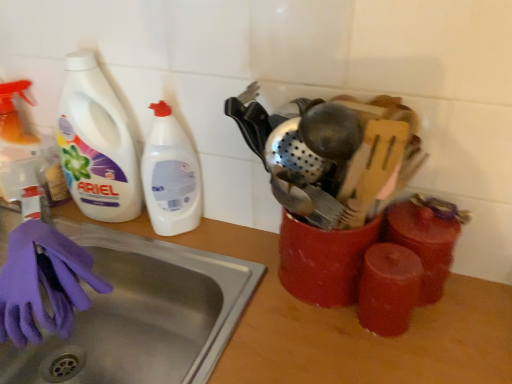
Question: Considering the relative sizes of purple rubber glove at lower left and white plastic bottle at left in the image provided, is purple rubber glove at lower left wider than white plastic bottle at left?

Choices:
 (A) yes
 (B) no

Answer: (A)

Question: From the image's perspective, is purple rubber glove at lower left beneath white plastic bottle at left?

Choices:
 (A) no
 (B) yes

Answer: (B)

Question: Can you confirm if purple rubber glove at lower left is taller than white plastic bottle at left?

Choices:
 (A) yes
 (B) no

Answer: (B)

Question: Is purple rubber glove at lower left beside white plastic bottle at left?

Choices:
 (A) yes
 (B) no

Answer: (B)

Question: Is purple rubber glove at lower left positioned with its back to white plastic bottle at left?

Choices:
 (A) yes
 (B) no

Answer: (A)

Question: Is purple rubber glove at lower left bigger than white plastic bottle at left?

Choices:
 (A) yes
 (B) no

Answer: (A)

Question: Could purple rubber glove at lower left be considered to be inside white plastic bottle at left?

Choices:
 (A) no
 (B) yes

Answer: (A)

Question: From a real-world perspective, is white plastic bottle at left on purple rubber glove at lower left?

Choices:
 (A) yes
 (B) no

Answer: (A)

Question: Is the depth of white plastic bottle at left greater than that of purple rubber glove at lower left?

Choices:
 (A) yes
 (B) no

Answer: (A)

Question: Is white plastic bottle at left shorter than purple rubber glove at lower left?

Choices:
 (A) yes
 (B) no

Answer: (B)

Question: Could you tell me if white plastic bottle at left is turned towards purple rubber glove at lower left?

Choices:
 (A) yes
 (B) no

Answer: (A)

Question: Can you confirm if white plastic bottle at left is bigger than purple rubber glove at lower left?

Choices:
 (A) no
 (B) yes

Answer: (B)

Question: Is wooden counter top at center positioned with its back to purple rubber glove at lower left?

Choices:
 (A) yes
 (B) no

Answer: (B)